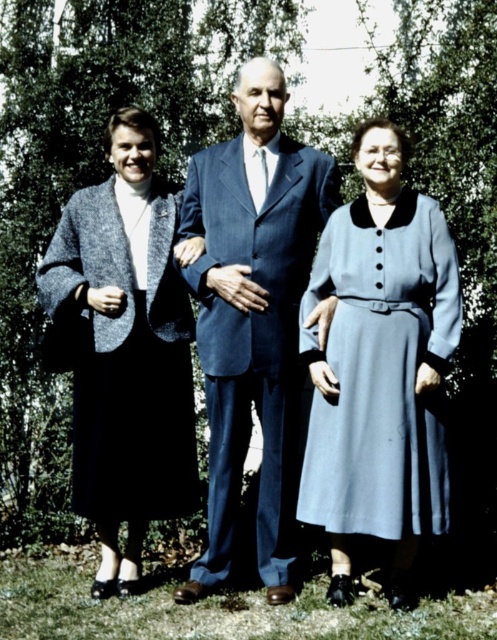
Question: Is matte gray coat at left thinner than light blue fabric dress at center?

Choices:
 (A) no
 (B) yes

Answer: (A)

Question: Observing the image, what is the correct spatial positioning of matte blue suit at center in reference to light blue fabric dress at center?

Choices:
 (A) above
 (B) below

Answer: (A)

Question: Among these points, which one is farthest from the camera?

Choices:
 (A) (293, 256)
 (B) (132, 195)
 (C) (333, 273)
 (D) (296, 211)

Answer: (B)

Question: Which of the following is the closest to the observer?

Choices:
 (A) (126, 556)
 (B) (410, 422)

Answer: (B)

Question: Considering the relative positions of blue fabric suit at center and light blue fabric dress at center in the image provided, where is blue fabric suit at center located with respect to light blue fabric dress at center?

Choices:
 (A) above
 (B) below

Answer: (A)

Question: Among these objects, which one is farthest from the camera?

Choices:
 (A) light blue fabric dress at center
 (B) matte blue suit at center
 (C) blue fabric suit at center
 (D) matte gray coat at left

Answer: (D)